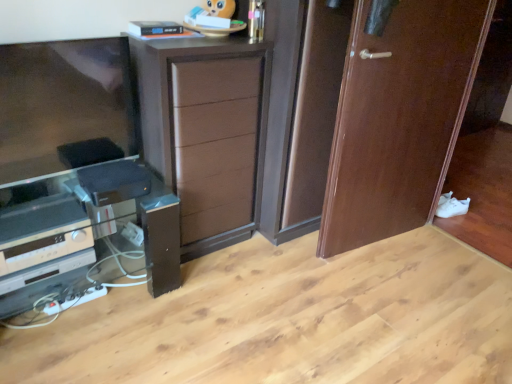
The image size is (512, 384). Find the location of `vacant area in front of white matte shoe at lower right`. vacant area in front of white matte shoe at lower right is located at coordinates (465, 227).